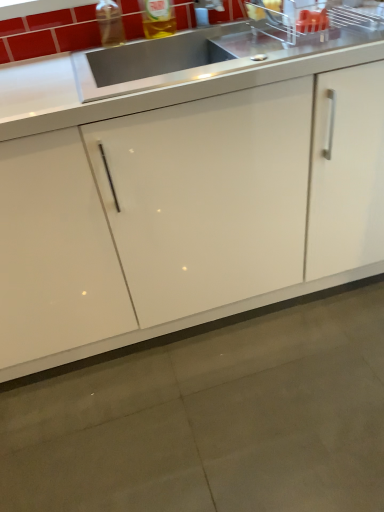
Question: Is white glossy cabinet at center behind translucent plastic bottle at upper center?

Choices:
 (A) no
 (B) yes

Answer: (A)

Question: From a real-world perspective, is white glossy cabinet at center physically above translucent plastic bottle at upper center?

Choices:
 (A) no
 (B) yes

Answer: (A)

Question: Is white glossy cabinet at center oriented away from translucent plastic bottle at upper center?

Choices:
 (A) no
 (B) yes

Answer: (A)

Question: Is the position of white glossy cabinet at center less distant than that of translucent plastic bottle at upper center?

Choices:
 (A) no
 (B) yes

Answer: (B)

Question: From the image's perspective, is white glossy cabinet at center located beneath translucent plastic bottle at upper center?

Choices:
 (A) yes
 (B) no

Answer: (A)

Question: Is white glossy cabinet at center at the left side of translucent plastic bottle at upper center?

Choices:
 (A) no
 (B) yes

Answer: (A)

Question: From the image's perspective, is satin steel sink at upper center below translucent plastic bottle at upper center?

Choices:
 (A) no
 (B) yes

Answer: (B)

Question: From the image's perspective, is satin steel sink at upper center above translucent plastic bottle at upper center?

Choices:
 (A) no
 (B) yes

Answer: (A)

Question: Is satin steel sink at upper center directly adjacent to translucent plastic bottle at upper center?

Choices:
 (A) yes
 (B) no

Answer: (B)

Question: From a real-world perspective, is satin steel sink at upper center beneath translucent plastic bottle at upper center?

Choices:
 (A) no
 (B) yes

Answer: (B)

Question: Is satin steel sink at upper center taller than translucent plastic bottle at upper center?

Choices:
 (A) no
 (B) yes

Answer: (A)

Question: Is satin steel sink at upper center thinner than translucent plastic bottle at upper center?

Choices:
 (A) no
 (B) yes

Answer: (A)

Question: From a real-world perspective, is transparent plastic bottle at upper left positioned over translucent plastic bottle at upper center based on gravity?

Choices:
 (A) yes
 (B) no

Answer: (B)